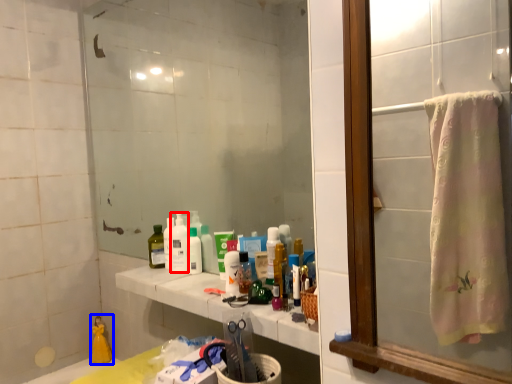
Question: Among these objects, which one is farthest to the camera, cleaning product (highlighted by a red box) or product (highlighted by a blue box)?

Choices:
 (A) cleaning product
 (B) product

Answer: (B)